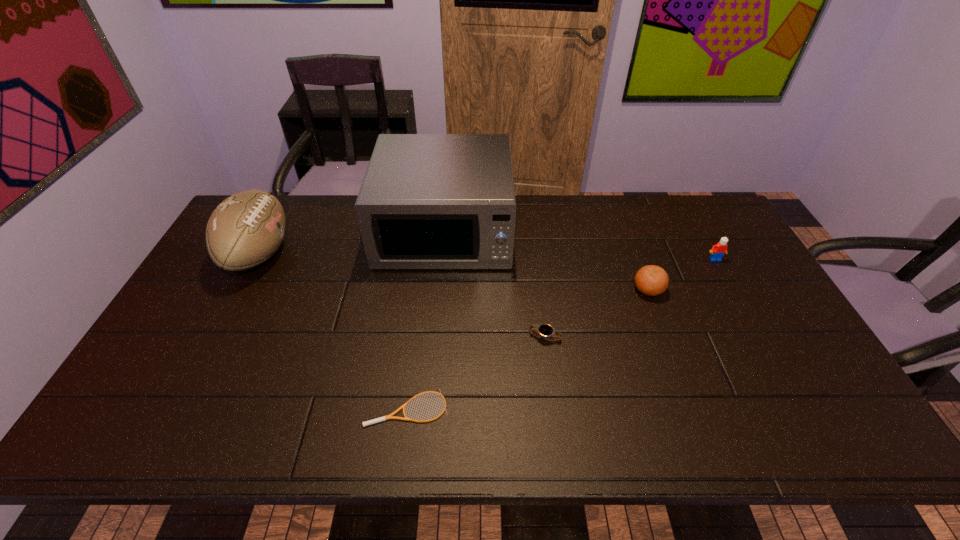
The height and width of the screenshot is (540, 960). I want to click on microwave oven, so click(x=427, y=201).

This screenshot has height=540, width=960. I want to click on the fifth shortest object, so click(x=246, y=229).

You are a GUI agent. You are given a task and a screenshot of the screen. Output one action in this format:
    pyautogui.click(x=<x>, y=<y>)
    Task: Click on the leftmost object
    
    Given the screenshot: What is the action you would take?
    pyautogui.click(x=246, y=229)

At what (x,y) coordinates should I click in order to perform the action: click on Lego. Please return your answer as a coordinate pair (x, y). Image resolution: width=960 pixels, height=540 pixels. Looking at the image, I should click on (718, 250).

Locate an element on the screen. The width and height of the screenshot is (960, 540). the third shortest object is located at coordinates (651, 280).

At what (x,y) coordinates should I click in order to perform the action: click on the second object from right to left. Please return your answer as a coordinate pair (x, y). This screenshot has width=960, height=540. Looking at the image, I should click on (651, 280).

Identify the location of the third object from right to left. Image resolution: width=960 pixels, height=540 pixels. coord(545,331).

The width and height of the screenshot is (960, 540). Find the location of `the second nearest object`. the second nearest object is located at coordinates (545, 331).

At what (x,y) coordinates should I click in order to perform the action: click on the shortest object. Please return your answer as a coordinate pair (x, y). Looking at the image, I should click on (390, 416).

Find the location of `tennis racket`. tennis racket is located at coordinates (390, 416).